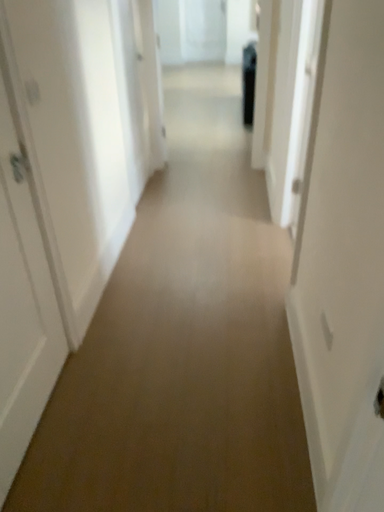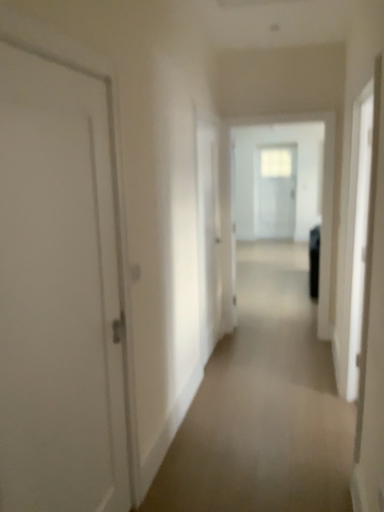
Question: How did the camera likely rotate when shooting the video?

Choices:
 (A) rotated left
 (B) rotated right

Answer: (A)